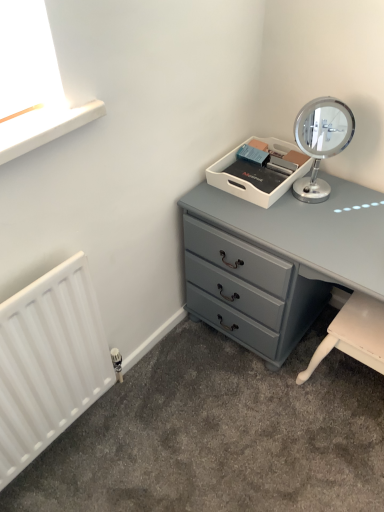
Question: Is matte gray chest of drawers at center wider or thinner than white plastic tray at upper center?

Choices:
 (A) wide
 (B) thin

Answer: (A)

Question: From the image's perspective, relative to white plastic tray at upper center, is matte gray chest of drawers at center above or below?

Choices:
 (A) below
 (B) above

Answer: (A)

Question: Which object is positioned farthest from the white matte radiator at lower left?

Choices:
 (A) polished chrome mirror at upper right
 (B) matte gray chest of drawers at center
 (C) white plastic tray at upper center

Answer: (A)

Question: Which object is the closest to the matte gray chest of drawers at center?

Choices:
 (A) polished chrome mirror at upper right
 (B) white plastic tray at upper center
 (C) white matte radiator at lower left

Answer: (B)